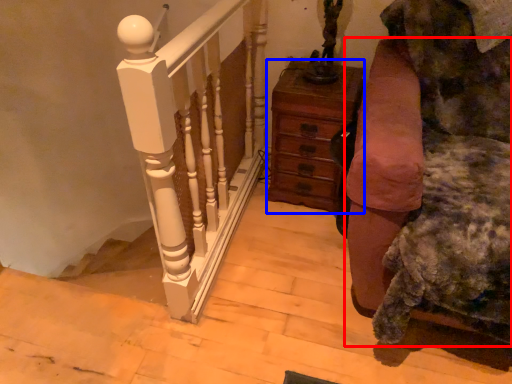
Question: Which object is further to the camera taking this photo, furniture (highlighted by a red box) or chest of drawers (highlighted by a blue box)?

Choices:
 (A) furniture
 (B) chest of drawers

Answer: (B)